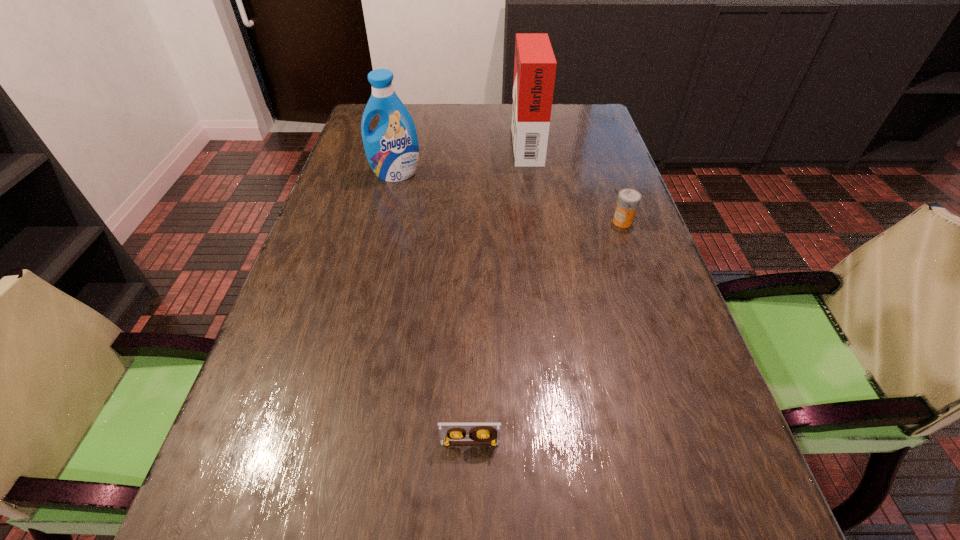
At what (x,y) coordinates should I click in order to perform the action: click on cigarette case. Please return your answer as a coordinate pair (x, y). The height and width of the screenshot is (540, 960). Looking at the image, I should click on (535, 65).

In order to click on the farthest object in this screenshot , I will do `click(535, 65)`.

Locate an element on the screen. Image resolution: width=960 pixels, height=540 pixels. the second farthest object is located at coordinates (392, 150).

The width and height of the screenshot is (960, 540). Identify the location of the leftmost object. (392, 150).

The image size is (960, 540). I want to click on the rightmost object, so click(628, 200).

Find the location of a particular element. The image size is (960, 540). the second nearest object is located at coordinates (628, 200).

Locate an element on the screen. The width and height of the screenshot is (960, 540). videotape is located at coordinates (449, 433).

Locate an element on the screen. the nearest object is located at coordinates (449, 433).

Locate an element on the screen. The width and height of the screenshot is (960, 540). blank space located on the front-facing side of the second object from right to left is located at coordinates (387, 143).

What are the coordinates of `vacant area situated 0.190m on the front-facing side of the second object from right to left` in the screenshot? It's located at (451, 143).